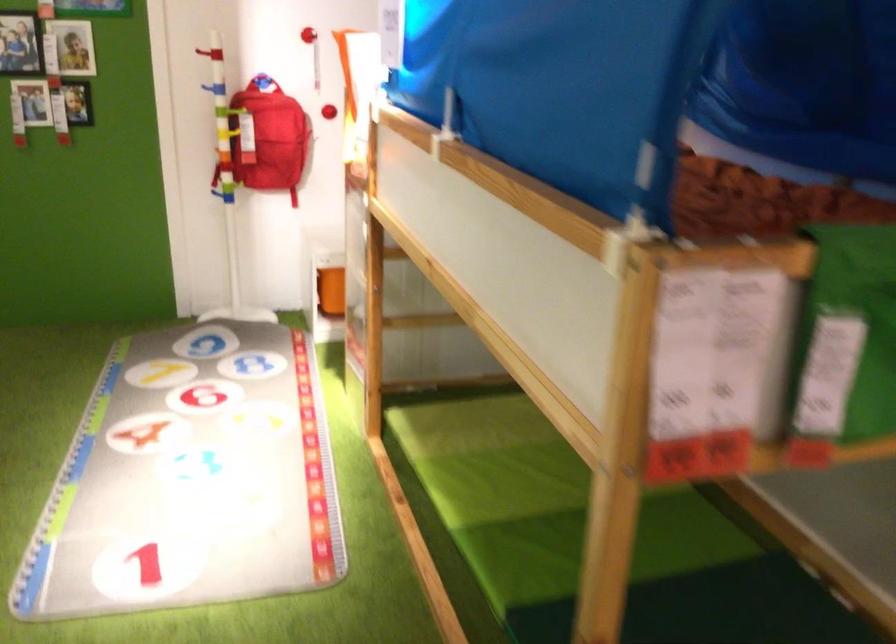
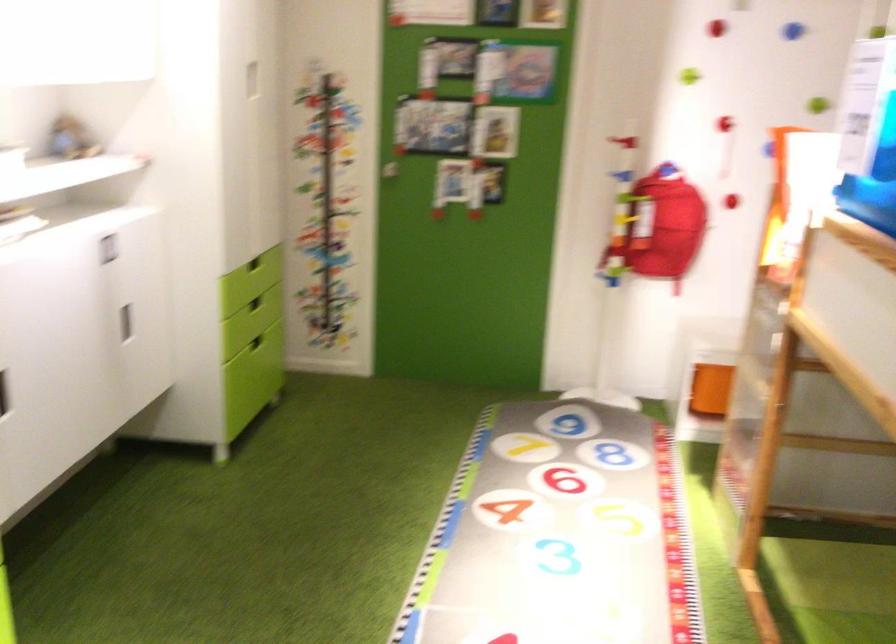
Find the pixel in the second image that matches (262,138) in the first image.

(659, 227)